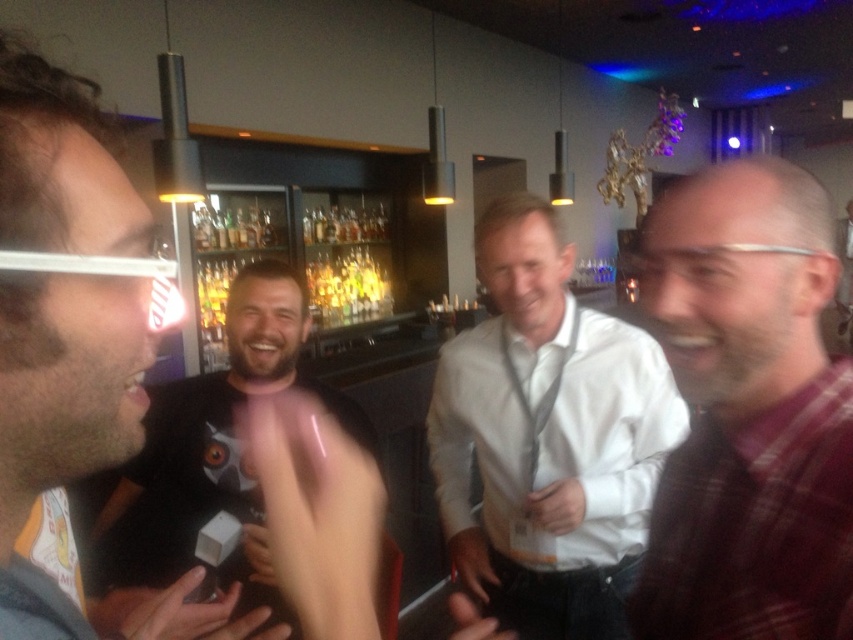
You are at a bar and want to order a drink. You see a person wearing a plaid fabric shirt at right and a person wearing a white shirt at center. Which person is closer to the right side of the bar?

The plaid fabric shirt at right is positioned on the right side of white shirt at center, so the person wearing the plaid fabric shirt at right is closer to the right side of the bar.

You are a bartender preparing to serve drinks to the guests. You notice two people wearing the plaid fabric shirt at right and the white shirt at center. Which guest should you approach first if you want to serve the drink to the person closer to the bar counter?

The white shirt at center is closer to the bar counter because the plaid fabric shirt at right is located above it, meaning the white shirt at center is positioned lower and likely nearer to the bar.

You are a photographer at the event and want to capture a photo of both the white shirt at center and the matte black shirt at left without any obstruction. Given their positions, is it possible to frame them both in the shot without one blocking the other?

The matte black shirt at left is behind the white shirt at center, so to capture both without obstruction, you would need to adjust their positions or the camera angle to ensure the matte black shirt at left is not hidden behind the white shirt at center.